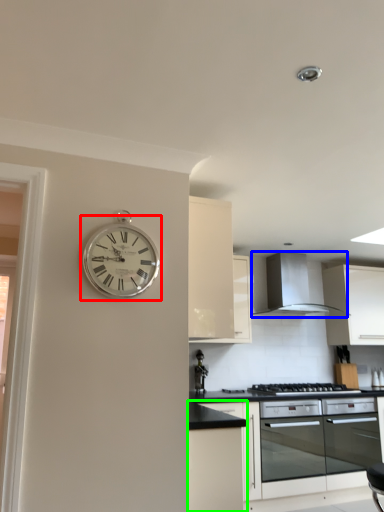
Question: Estimate the real-world distances between objects in this image. Which object is closer to wall clock (highlighted by a red box), exhaust hood (highlighted by a blue box) or cabinetry (highlighted by a green box)?

Choices:
 (A) exhaust hood
 (B) cabinetry

Answer: (B)